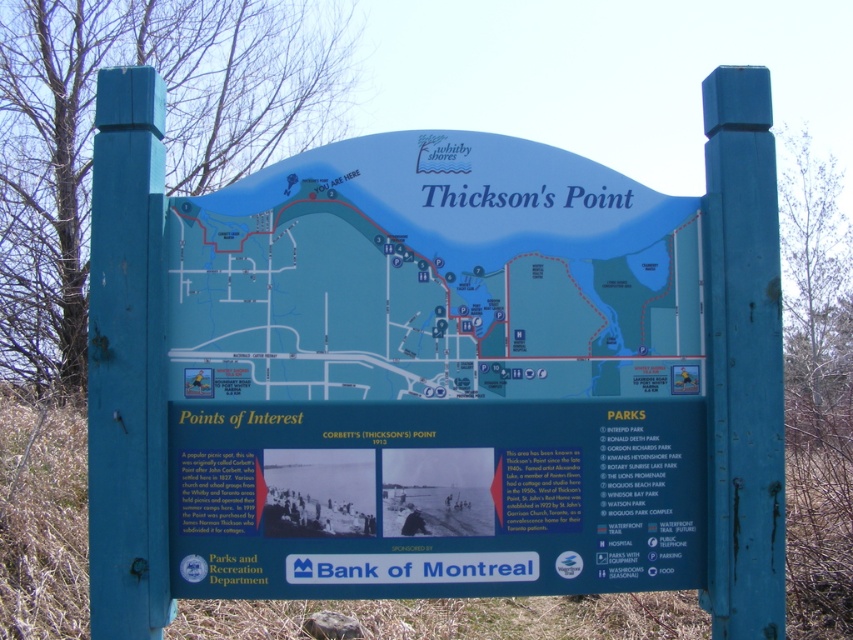
Question: Can you confirm if blue plastic map at center is positioned below matte blue signboard at center?

Choices:
 (A) yes
 (B) no

Answer: (B)

Question: Which object is closer to the camera taking this photo?

Choices:
 (A) blue plastic map at center
 (B) matte blue signboard at center

Answer: (B)

Question: Does blue plastic map at center appear on the right side of matte blue signboard at center?

Choices:
 (A) no
 (B) yes

Answer: (A)

Question: Is blue plastic map at center below matte blue signboard at center?

Choices:
 (A) no
 (B) yes

Answer: (A)